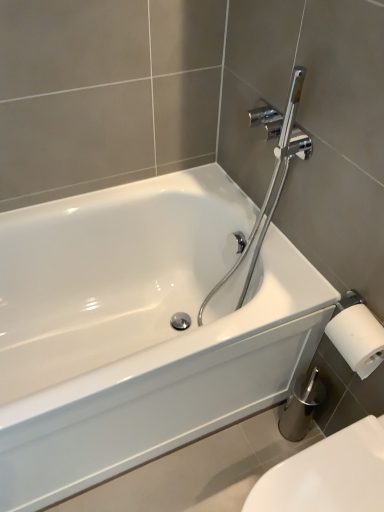
Question: From the image's perspective, is white glossy bathtub at center located above or below chrome/polished metal showerhead at upper right?

Choices:
 (A) below
 (B) above

Answer: (A)

Question: Looking at their shapes, would you say white glossy bathtub at center is wider or thinner than chrome/polished metal showerhead at upper right?

Choices:
 (A) wide
 (B) thin

Answer: (A)

Question: Which is nearer to the white glossy bathtub at center?

Choices:
 (A) chrome/polished metal showerhead at upper right
 (B) white glossy toilet at lower right

Answer: (A)

Question: Which object is the closest to the white glossy toilet at lower right?

Choices:
 (A) chrome/polished metal showerhead at upper right
 (B) white glossy bathtub at center

Answer: (B)